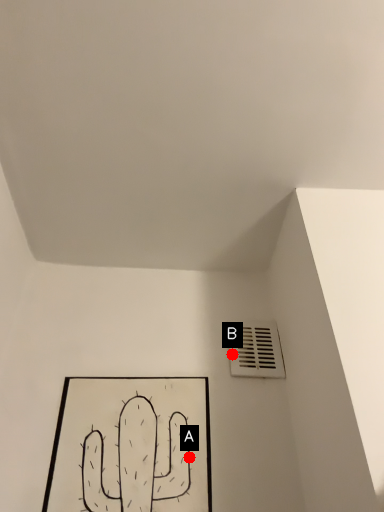
Question: Two points are circled on the image, labeled by A and B beside each circle. Which point is closer to the camera?

Choices:
 (A) A is closer
 (B) B is closer

Answer: (A)